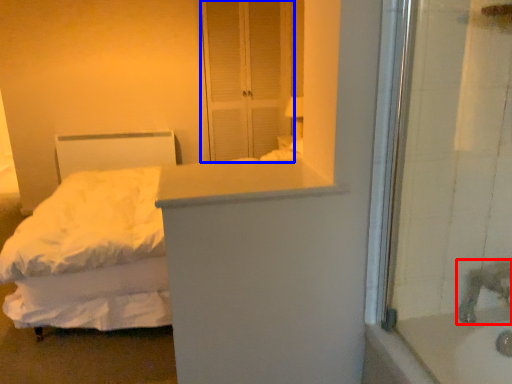
Question: Which object appears closest to the camera in this image, faucet (highlighted by a red box) or screen door (highlighted by a blue box)?

Choices:
 (A) faucet
 (B) screen door

Answer: (A)